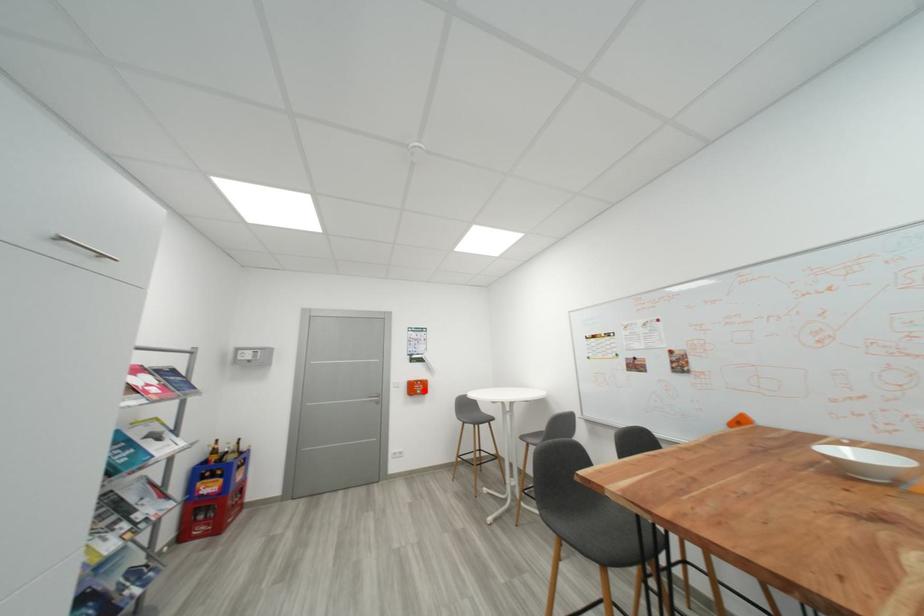
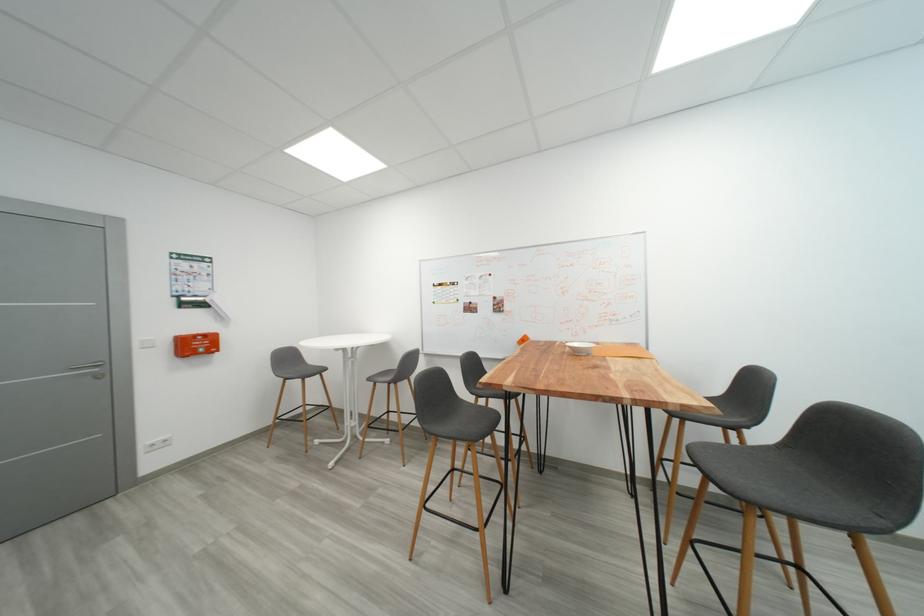
Question: I am providing you with two images of the same scene from different viewpoints. Given a red point in image1, look at the same physical point in image2. Is it:

Choices:
 (A) Closer to the viewpoint
 (B) Farther from the viewpoint

Answer: (A)